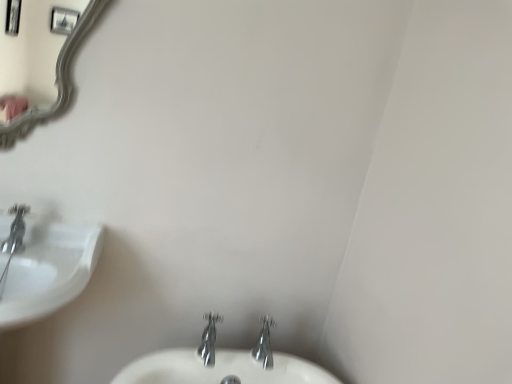
Question: Considering the relative sizes of polished chrome faucet at center, which ranks as the 1th tap in left-to-right order, and white glossy sink at left in the image provided, is polished chrome faucet at center, which ranks as the 1th tap in left-to-right order, bigger than white glossy sink at left?

Choices:
 (A) yes
 (B) no

Answer: (B)

Question: Is polished chrome faucet at center, the second tap when ordered from right to left, next to white glossy sink at left and touching it?

Choices:
 (A) no
 (B) yes

Answer: (A)

Question: From a real-world perspective, is polished chrome faucet at center, which ranks as the 1th tap in left-to-right order, on white glossy sink at left?

Choices:
 (A) yes
 (B) no

Answer: (A)

Question: Is polished chrome faucet at center, which ranks as the 1th tap in left-to-right order, behind white glossy sink at left?

Choices:
 (A) no
 (B) yes

Answer: (B)

Question: Could you tell me if polished chrome faucet at center, which ranks as the 1th tap in left-to-right order, is turned towards white glossy sink at left?

Choices:
 (A) no
 (B) yes

Answer: (A)

Question: Considering their positions, is polished chrome faucet at center, the second tap when ordered from right to left, located in front of or behind white glossy sink at left?

Choices:
 (A) behind
 (B) front

Answer: (A)

Question: Is point (208, 354) positioned closer to the camera than point (75, 294)?

Choices:
 (A) farther
 (B) closer

Answer: (A)

Question: Is polished chrome faucet at center, the second tap when ordered from right to left, situated inside white glossy sink at left or outside?

Choices:
 (A) outside
 (B) inside

Answer: (A)

Question: From a real-world perspective, is polished chrome faucet at center, the second tap when ordered from right to left, physically located above or below white glossy sink at left?

Choices:
 (A) below
 (B) above

Answer: (B)

Question: Is chrome metallic faucet at lower center, placed as the 1th tap when sorted from right to left, bigger or smaller than polished chrome faucet at center, which ranks as the 1th tap in left-to-right order?

Choices:
 (A) small
 (B) big

Answer: (A)

Question: From the image's perspective, is chrome metallic faucet at lower center, arranged as the 2th tap when viewed from the left, located above or below polished chrome faucet at center, the second tap when ordered from right to left?

Choices:
 (A) below
 (B) above

Answer: (A)

Question: Considering the positions of chrome metallic faucet at lower center, arranged as the 2th tap when viewed from the left, and polished chrome faucet at center, which ranks as the 1th tap in left-to-right order, in the image, is chrome metallic faucet at lower center, arranged as the 2th tap when viewed from the left, wider or thinner than polished chrome faucet at center, which ranks as the 1th tap in left-to-right order,?

Choices:
 (A) wide
 (B) thin

Answer: (B)

Question: In terms of height, does chrome metallic faucet at lower center, arranged as the 2th tap when viewed from the left, look taller or shorter compared to polished chrome faucet at center, the second tap when ordered from right to left?

Choices:
 (A) tall
 (B) short

Answer: (A)

Question: Is point (258, 337) positioned closer to the camera than point (30, 216)?

Choices:
 (A) closer
 (B) farther

Answer: (B)

Question: Considering their positions, is chrome metallic faucet at lower center, placed as the 1th tap when sorted from right to left, located in front of or behind white glossy sink at left?

Choices:
 (A) front
 (B) behind

Answer: (B)